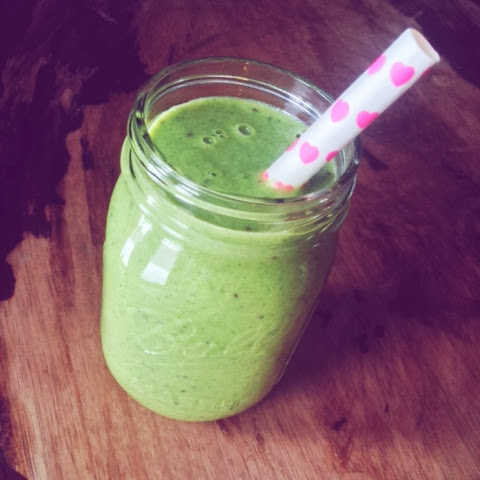
Locate an element on the screen. wood surface is located at coordinates (406, 334), (73, 222), (258, 38).